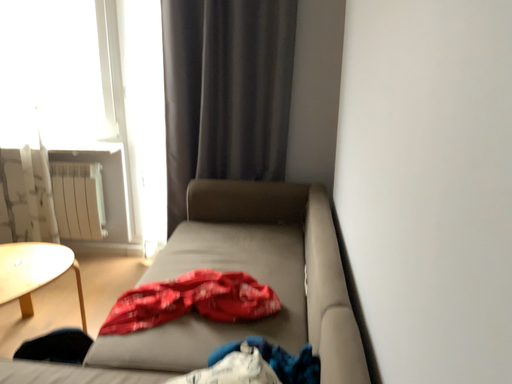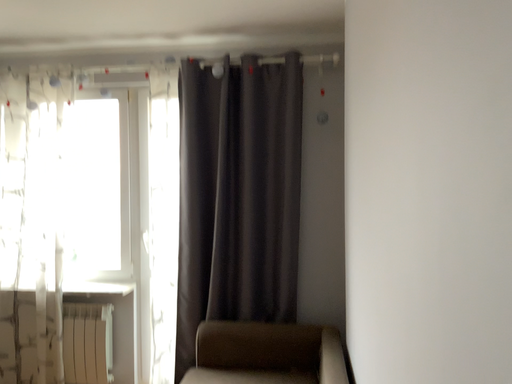
Question: How did the camera likely rotate when shooting the video?

Choices:
 (A) rotated upward
 (B) rotated downward

Answer: (A)